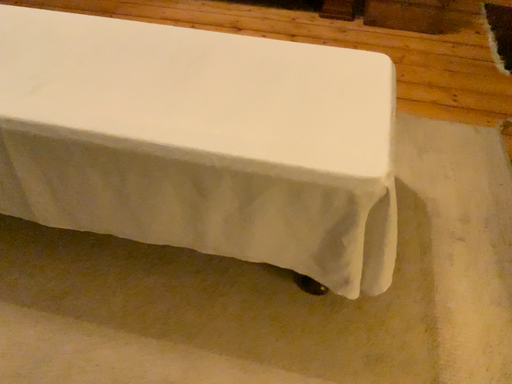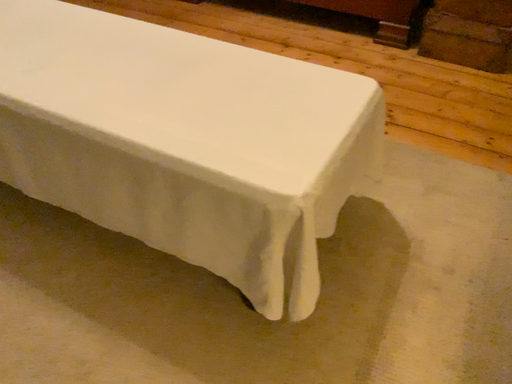
Question: How did the camera likely rotate when shooting the video?

Choices:
 (A) rotated right
 (B) rotated left

Answer: (B)